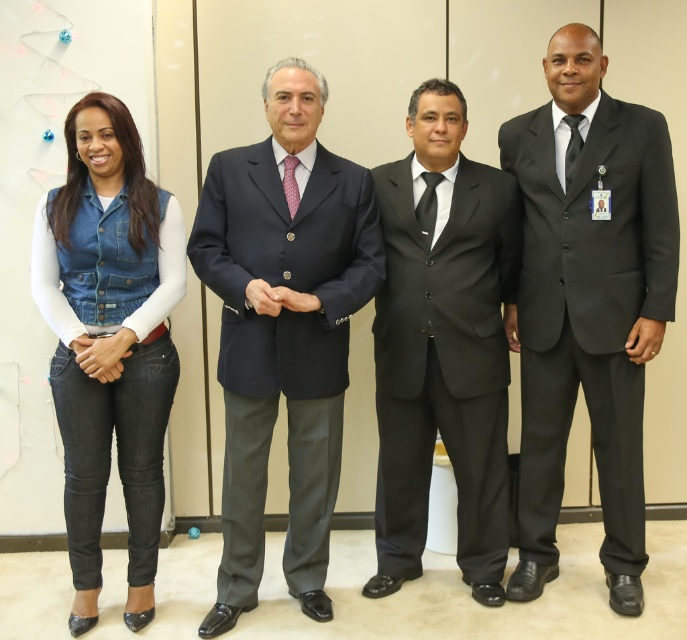
You are organizing a formal event and need to arrange the black satin suit at center and the black satin tie at right on a display rack. According to the image, which item should be placed to the left of the other?

According to the image, the black satin suit at center should be placed to the left of the black satin tie at right because the black satin suit at center is to the left of black satin tie at right.